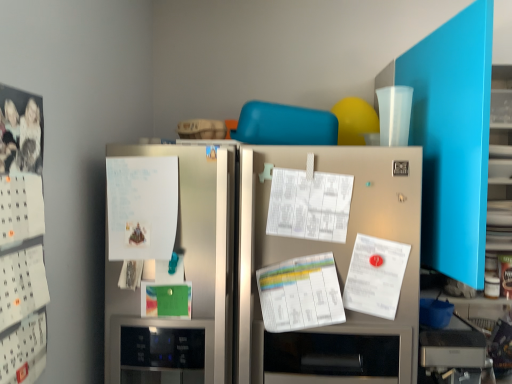
The width and height of the screenshot is (512, 384). What do you see at coordinates (335, 262) in the screenshot?
I see `satin silver refrigerator at center` at bounding box center [335, 262].

What is the approximate height of white paper at left?

white paper at left is 12.03 inches tall.

Locate an element on the screen. white paper at left is located at coordinates (142, 207).

This screenshot has height=384, width=512. Describe the element at coordinates (21, 238) in the screenshot. I see `white paper calendar at left` at that location.

At what (x,y) coordinates should I click in order to perform the action: click on satin silver refrigerator at center. Please return your answer as a coordinate pair (x, y). Looking at the image, I should click on (335, 262).

Image resolution: width=512 pixels, height=384 pixels. Find the location of `poster behind the white paper calendar at left`. poster behind the white paper calendar at left is located at coordinates (142, 207).

Is white paper calendar at left smaller than white paper at left?

Actually, white paper calendar at left might be larger than white paper at left.

Is white paper at left at the back of white paper calendar at left?

No, white paper calendar at left is not facing the opposite direction of white paper at left.

In terms of height, does white paper calendar at left look taller or shorter compared to white paper at left?

Clearly, white paper calendar at left is taller compared to white paper at left.

You are a GUI agent. You are given a task and a screenshot of the screen. Output one action in this format:
    pyautogui.click(x=<x>, y=<y>)
    Task: Click on the bulletin board located in front of the white paper at left
    The height and width of the screenshot is (384, 512).
    Given the screenshot: What is the action you would take?
    pyautogui.click(x=21, y=238)

How different are the orientations of white paper at left and white paper calendar at left in degrees?

The angle between the facing direction of white paper at left and the facing direction of white paper calendar at left is 92.1 degrees.

Is white paper calendar at left at the back of white paper at left?

No.

Is white paper calendar at left facing away from satin silver refrigerator at center?

No, white paper calendar at left is not facing the opposite direction of satin silver refrigerator at center.

From the image's perspective, is white paper calendar at left located above or below satin silver refrigerator at center?

white paper calendar at left is above satin silver refrigerator at center.

What's the angular difference between white paper calendar at left and satin silver refrigerator at center's facing directions?

They differ by 90.2 degrees in their facing directions.

Locate an element on the screen. bulletin board above the satin silver refrigerator at center (from the image's perspective) is located at coordinates (21, 238).

Considering the positions of objects satin silver refrigerator at center and white paper at left in the image provided, who is behind, satin silver refrigerator at center or white paper at left?

white paper at left.

In the scene shown: How different are the orientations of satin silver refrigerator at center and white paper at left in degrees?

The facing directions of satin silver refrigerator at center and white paper at left are 1.87 degrees apart.

Which is more to the right, satin silver refrigerator at center or white paper at left?

A: satin silver refrigerator at center.

Is point (381, 204) closer or farther from the camera than point (140, 187)?

Point (381, 204) is closer to the camera than point (140, 187).

Which is more to the left, white paper at left or satin silver refrigerator at center?

white paper at left.

Does white paper at left have a smaller size compared to satin silver refrigerator at center?

Indeed, white paper at left has a smaller size compared to satin silver refrigerator at center.

Is white paper at left oriented towards satin silver refrigerator at center?

Yes, white paper at left is oriented towards satin silver refrigerator at center.

From the image's perspective, is satin silver refrigerator at center below white paper calendar at left?

Correct, satin silver refrigerator at center appears lower than white paper calendar at left in the image.

Can you confirm if satin silver refrigerator at center is wider than white paper calendar at left?

Indeed, satin silver refrigerator at center has a greater width compared to white paper calendar at left.

Are satin silver refrigerator at center and white paper calendar at left beside each other?

They are not placed beside each other.

There is a white paper calendar at left. Where is `poster above it (from a real-world perspective)`? The height and width of the screenshot is (384, 512). poster above it (from a real-world perspective) is located at coordinates (142, 207).

This screenshot has height=384, width=512. Find the location of `poster on the right side of white paper calendar at left`. poster on the right side of white paper calendar at left is located at coordinates (142, 207).

Which object lies further to the anchor point white paper calendar at left, white paper at left or satin silver refrigerator at center?

satin silver refrigerator at center.

From the image, which object appears to be nearer to white paper at left, white paper calendar at left or satin silver refrigerator at center?

Among the two, satin silver refrigerator at center is located nearer to white paper at left.

Considering their positions, is white paper calendar at left positioned closer to satin silver refrigerator at center than white paper at left?

Among the two, white paper at left is located nearer to satin silver refrigerator at center.

Which object lies nearer to the anchor point satin silver refrigerator at center, white paper at left or white paper calendar at left?

Among the two, white paper at left is located nearer to satin silver refrigerator at center.

Based on their spatial positions, is satin silver refrigerator at center or white paper at left further from white paper calendar at left?

satin silver refrigerator at center lies further to white paper calendar at left than the other object.

Estimate the real-world distances between objects in this image. Which object is closer to white paper at left, satin silver refrigerator at center or white paper calendar at left?

satin silver refrigerator at center lies closer to white paper at left than the other object.

Identify the location of poster between white paper calendar at left and satin silver refrigerator at center from left to right. The image size is (512, 384). (142, 207).